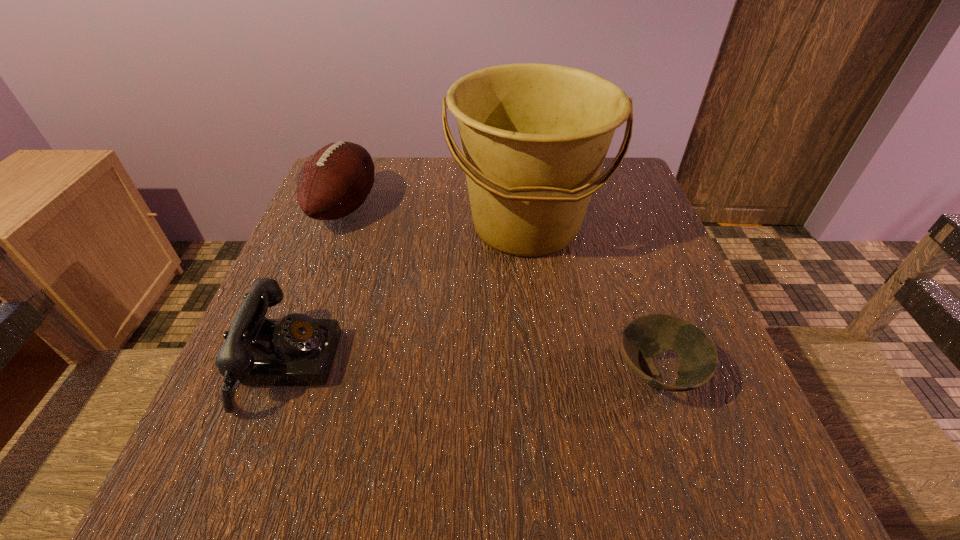
Locate an element on the screen. The width and height of the screenshot is (960, 540). bucket is located at coordinates (534, 137).

This screenshot has width=960, height=540. Find the location of `the third shortest object`. the third shortest object is located at coordinates (335, 181).

You are a GUI agent. You are given a task and a screenshot of the screen. Output one action in this format:
    pyautogui.click(x=<x>, y=<y>)
    Task: Click on the third tallest object
    The width and height of the screenshot is (960, 540).
    Given the screenshot: What is the action you would take?
    pyautogui.click(x=297, y=350)

Identify the location of bowl. (643, 338).

Where is `vacant space located on the side of the bucket with the handle`? Image resolution: width=960 pixels, height=540 pixels. vacant space located on the side of the bucket with the handle is located at coordinates (545, 382).

Where is `vacant region located 0.150m on the right of the football (American)`? vacant region located 0.150m on the right of the football (American) is located at coordinates (441, 207).

At what (x,y) coordinates should I click in order to perform the action: click on vacant position located 0.300m on the dial of the telephone. Please return your answer as a coordinate pair (x, y). The image size is (960, 540). Looking at the image, I should click on (517, 364).

At what (x,y) coordinates should I click in order to perform the action: click on vacant space located on the front of the bowl. Please return your answer as a coordinate pair (x, y). Looking at the image, I should click on (690, 474).

Find the location of a particular element. Image resolution: width=960 pixels, height=540 pixels. bucket that is at the far edge is located at coordinates tap(534, 137).

The image size is (960, 540). Find the location of `football (American) located in the far edge section of the desktop`. football (American) located in the far edge section of the desktop is located at coordinates (335, 181).